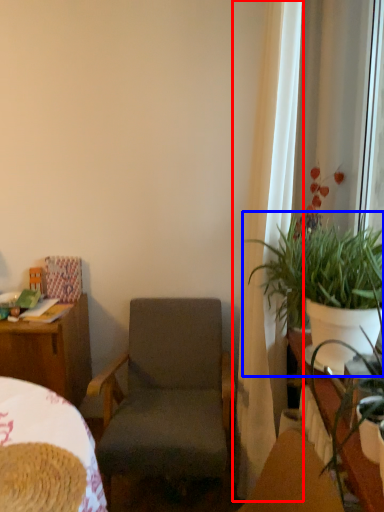
Question: Which object is further to the camera taking this photo, curtain (highlighted by a red box) or houseplant (highlighted by a blue box)?

Choices:
 (A) curtain
 (B) houseplant

Answer: (A)